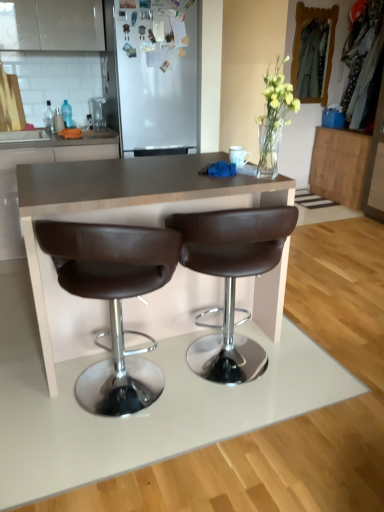
Identify the location of vacant space to the right of brown leather stool at center, the 2th chair positioned from the left. (323, 372).